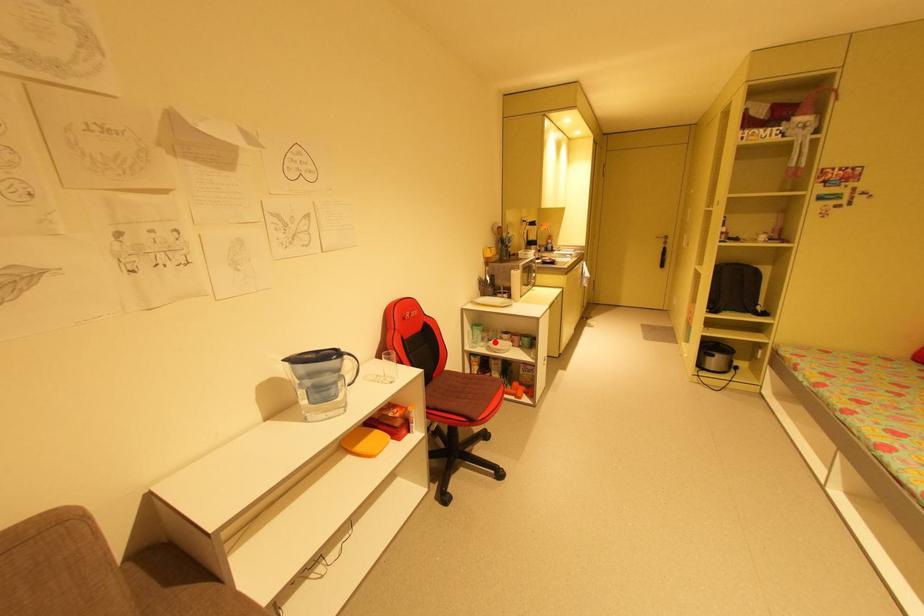
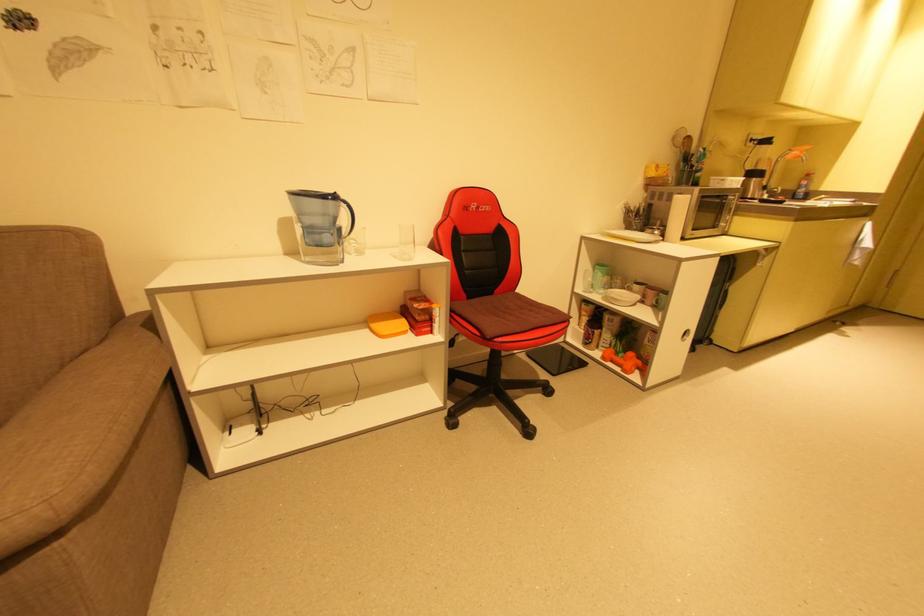
Question: I am providing you with two images of the same scene from different viewpoints. Image1 has a red point marked. In image2, the corresponding 3D location appears at what relative position? Reply with the corresponding letter.

Choices:
 (A) Closer
 (B) Farther

Answer: (A)